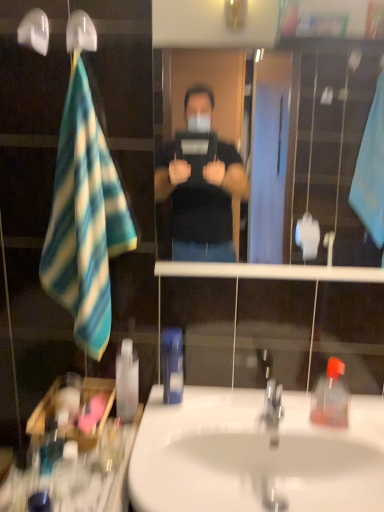
Where is `free space in front of blue plastic mouthwash at center, the third mouthwash from the left`? free space in front of blue plastic mouthwash at center, the third mouthwash from the left is located at coordinates (163, 429).